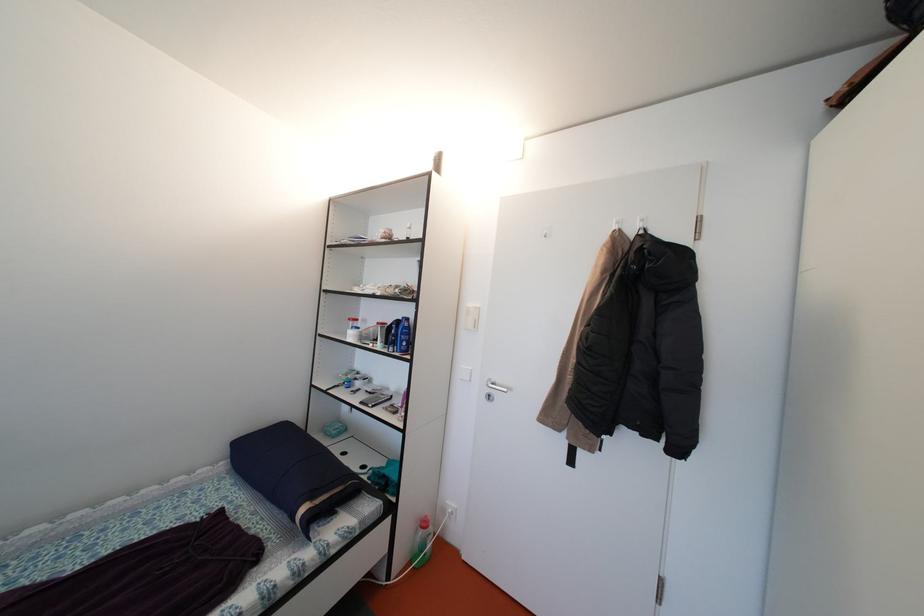
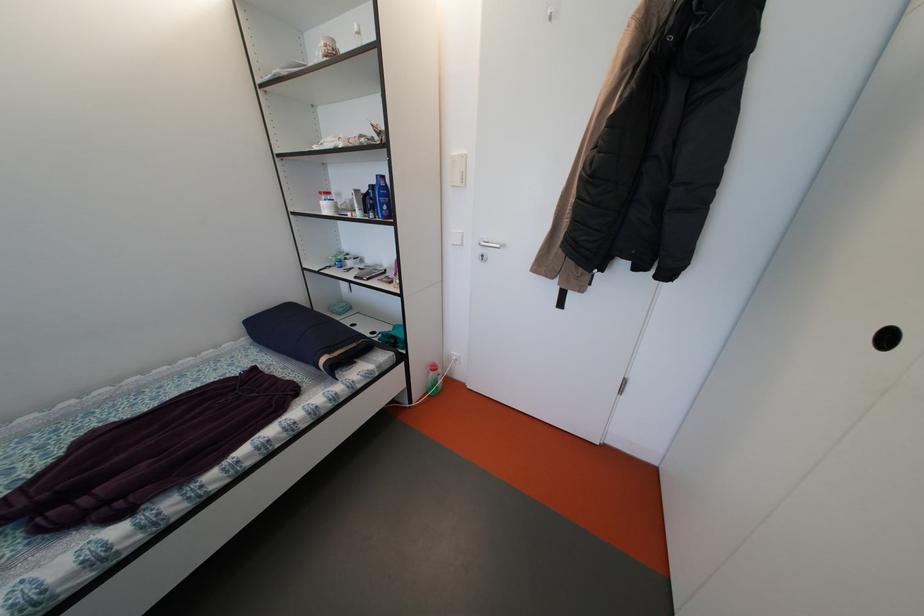
Where in the second image is the point corresponding to point (478, 309) from the first image?

(462, 156)